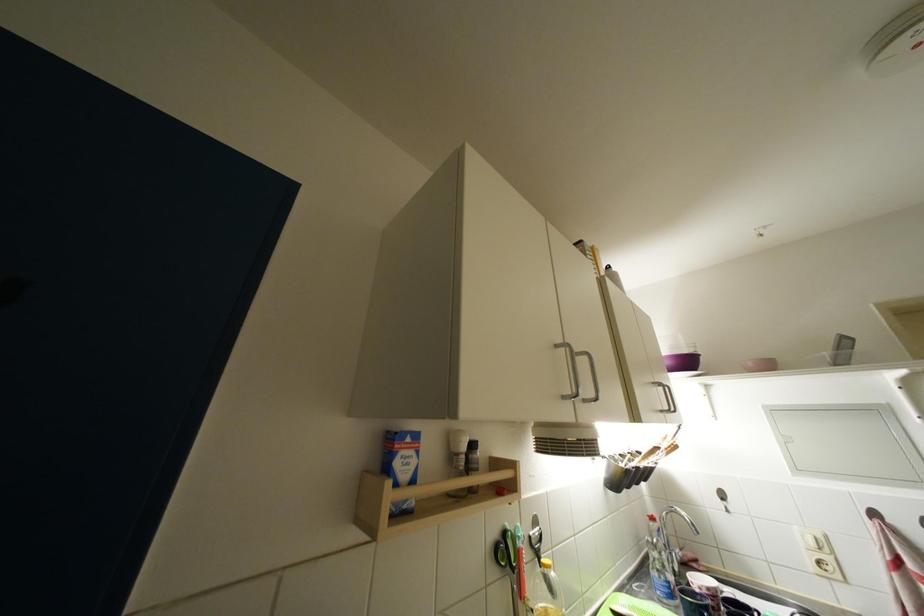
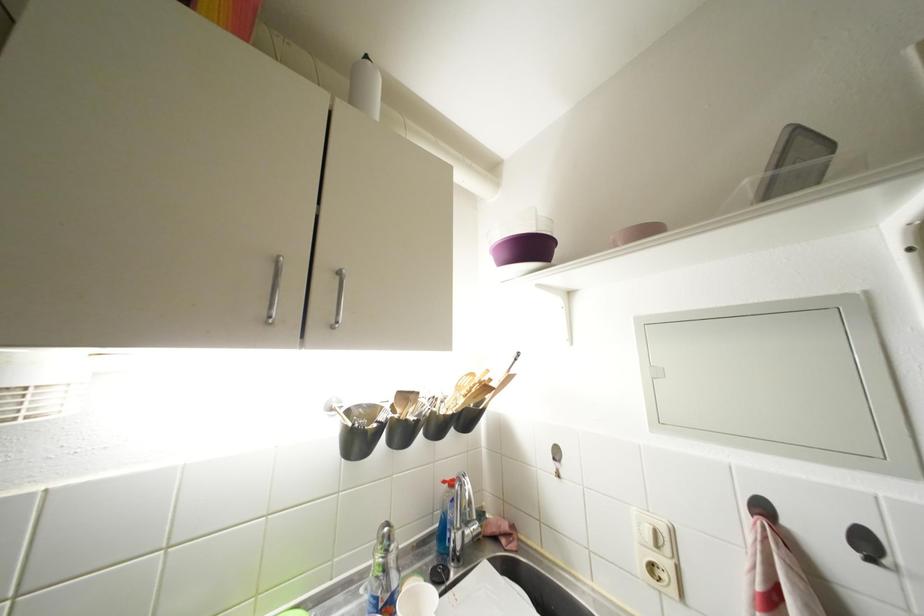
Locate, in the second image, the point that corresponds to point 659,523 in the first image.

(457, 488)